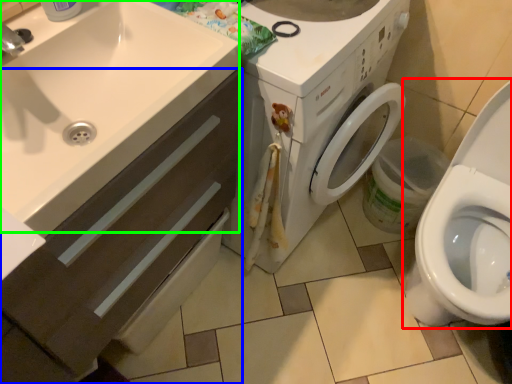
Question: Based on their relative distances, which object is farther from toilet (highlighted by a red box)? Choose from bathroom cabinet (highlighted by a blue box) and sink (highlighted by a green box).

Choices:
 (A) bathroom cabinet
 (B) sink

Answer: (B)